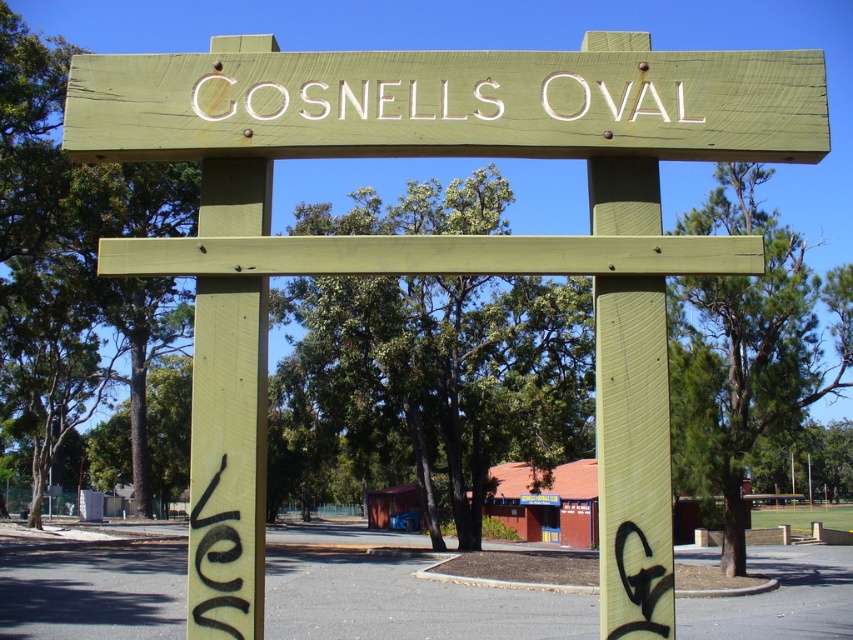
Is green wood sign at center above white painted wood sign at center?

Yes.

Is green wood sign at center bigger than white painted wood sign at center?

Correct, green wood sign at center is larger in size than white painted wood sign at center.

Measure the distance between point [640,131] and camera.

The distance of point [640,131] from camera is 3.12 meters.

Find the location of a particular element. green wood sign at center is located at coordinates (448, 104).